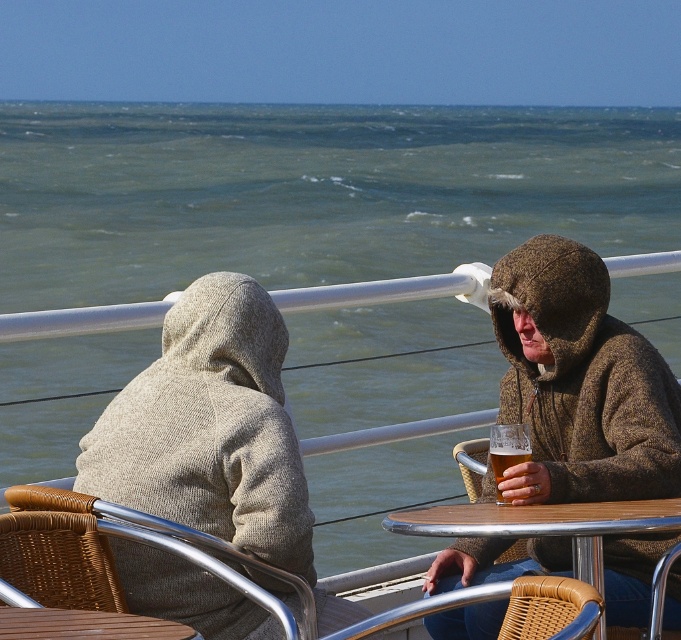
You are standing at the point labeled as point (x=313, y=192) in the image. What do you see in front of you?

You see greenish blue water at center in front of you.